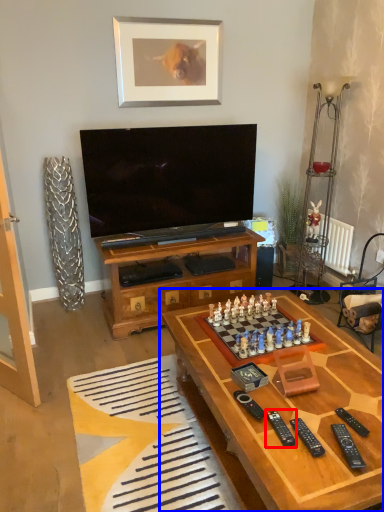
Question: Which of the following is the farthest to the observer, remote (highlighted by a red box) or table (highlighted by a blue box)?

Choices:
 (A) remote
 (B) table

Answer: (A)